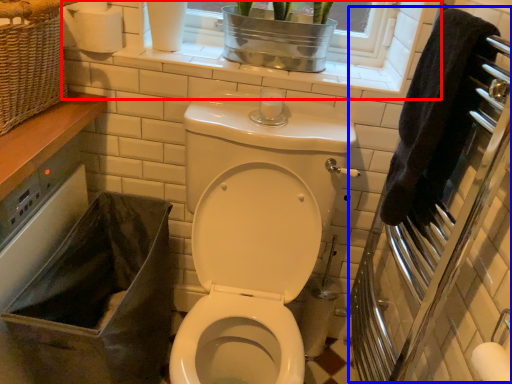
Question: Which of the following is the closest to the observer, window frame (highlighted by a red box) or screen door (highlighted by a blue box)?

Choices:
 (A) window frame
 (B) screen door

Answer: (B)